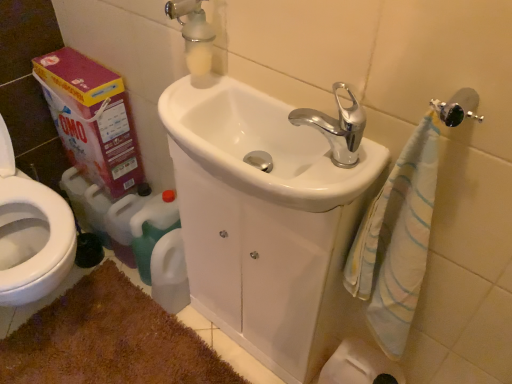
Question: Does white glossy sink at center have a greater width compared to white frosted glass soap dispenser at upper center?

Choices:
 (A) yes
 (B) no

Answer: (A)

Question: Is white glossy sink at center positioned behind white frosted glass soap dispenser at upper center?

Choices:
 (A) no
 (B) yes

Answer: (A)

Question: Is white glossy sink at center positioned beyond the bounds of white frosted glass soap dispenser at upper center?

Choices:
 (A) no
 (B) yes

Answer: (B)

Question: From the image's perspective, is white glossy sink at center located above white frosted glass soap dispenser at upper center?

Choices:
 (A) yes
 (B) no

Answer: (B)

Question: Is white glossy sink at center at the left side of white frosted glass soap dispenser at upper center?

Choices:
 (A) no
 (B) yes

Answer: (A)

Question: Does point (201, 52) appear closer or farther from the camera than point (335, 96)?

Choices:
 (A) closer
 (B) farther

Answer: (B)

Question: Would you say white frosted glass soap dispenser at upper center is to the left or to the right of chrome metallic faucet at upper center in the picture?

Choices:
 (A) right
 (B) left

Answer: (B)

Question: Considering the positions of white frosted glass soap dispenser at upper center and chrome metallic faucet at upper center in the image, is white frosted glass soap dispenser at upper center wider or thinner than chrome metallic faucet at upper center?

Choices:
 (A) thin
 (B) wide

Answer: (A)

Question: From the image's perspective, relative to chrome metallic faucet at upper center, is white frosted glass soap dispenser at upper center above or below?

Choices:
 (A) below
 (B) above

Answer: (B)

Question: Does point (189, 8) appear closer or farther from the camera than point (352, 168)?

Choices:
 (A) farther
 (B) closer

Answer: (A)

Question: Considering their positions, is white frosted glass soap dispenser at upper center located in front of or behind white glossy sink at center?

Choices:
 (A) front
 (B) behind

Answer: (B)

Question: Is white frosted glass soap dispenser at upper center to the left or to the right of white glossy sink at center in the image?

Choices:
 (A) left
 (B) right

Answer: (A)

Question: Is white frosted glass soap dispenser at upper center taller or shorter than white glossy sink at center?

Choices:
 (A) tall
 (B) short

Answer: (A)

Question: In the image, is matte cardboard box at left positioned in front of or behind brown shaggy bath mat at lower left?

Choices:
 (A) behind
 (B) front

Answer: (A)

Question: From the image's perspective, relative to brown shaggy bath mat at lower left, is matte cardboard box at left above or below?

Choices:
 (A) above
 (B) below

Answer: (A)